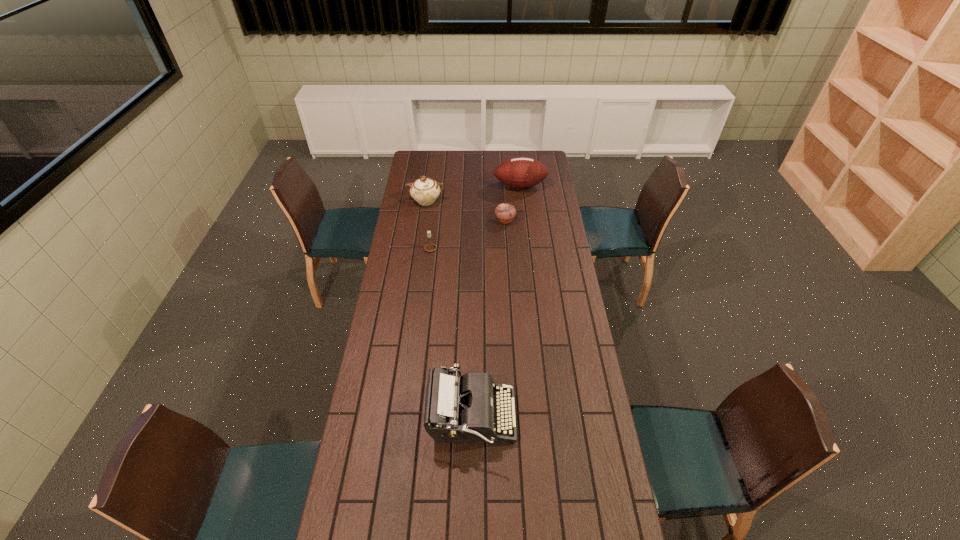
I want to click on the second closest object to the football (American), so click(x=425, y=191).

The width and height of the screenshot is (960, 540). Identify the location of free spot that satisfies the following two spatial constraints: 1. on the side of the fourth tallest object with the handle; 2. on the right side of the muffin. (434, 220).